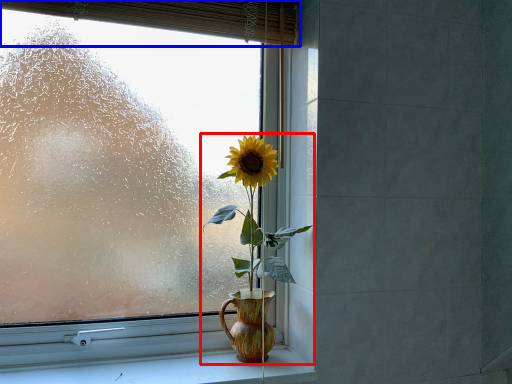
Question: Which object appears closest to the camera in this image, houseplant (highlighted by a red box) or curtain (highlighted by a blue box)?

Choices:
 (A) houseplant
 (B) curtain

Answer: (B)